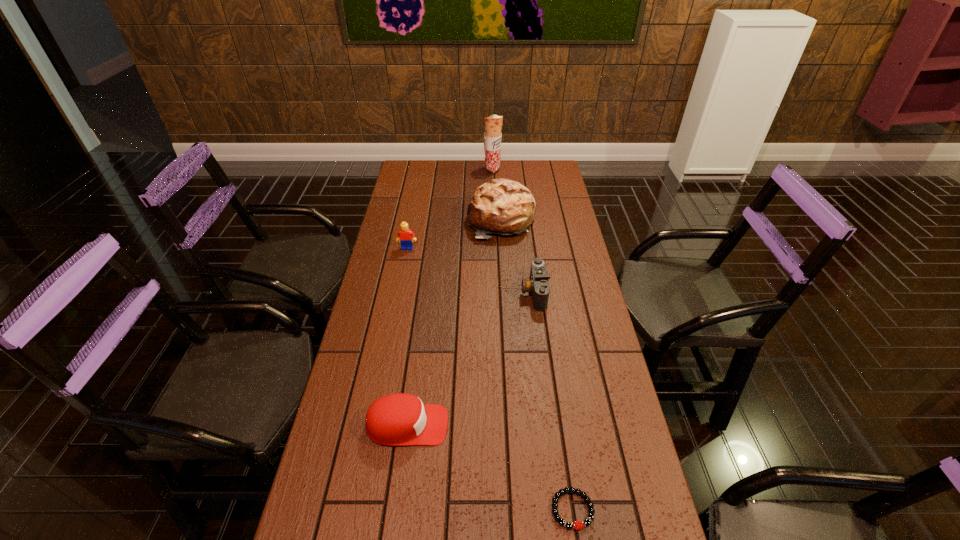
Identify the location of vacant space situated 0.330m on the front of the farthest object. Image resolution: width=960 pixels, height=540 pixels. (494, 213).

The image size is (960, 540). Find the location of `vacant region located 0.280m on the front of the bread`. vacant region located 0.280m on the front of the bread is located at coordinates (505, 294).

I want to click on free location located on the face of the third farthest object, so click(x=403, y=269).

Where is `free space located 0.190m on the lens of the camera`? free space located 0.190m on the lens of the camera is located at coordinates pos(466,292).

This screenshot has width=960, height=540. What are the coordinates of `vacant space located on the lens of the camera` in the screenshot? It's located at (451, 292).

Locate an element on the screen. free location located on the lens of the camera is located at coordinates (468, 292).

The width and height of the screenshot is (960, 540). What are the coordinates of `free space located on the front-facing side of the second nearest object` in the screenshot? It's located at (498, 426).

Identify the location of free region located on the left of the nearest object. (516, 509).

Identify the location of object present at the far edge. (493, 124).

Find the location of a particular element. Lego at the left edge is located at coordinates (405, 236).